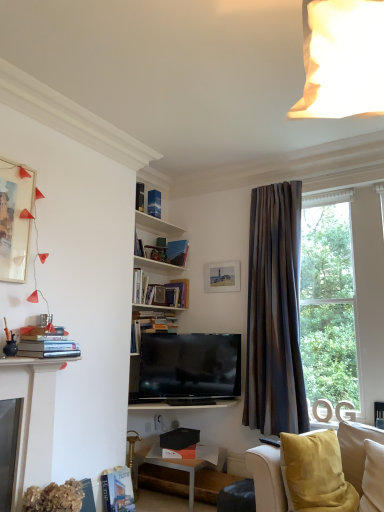
Question: Can you confirm if matte white picture frame at upper left, acting as the second picture frame starting from the back, is positioned to the left of hardcover book at center, which appears as the sixth book when viewed from the front?

Choices:
 (A) no
 (B) yes

Answer: (B)

Question: From the image's perspective, would you say matte white picture frame at upper left, acting as the second picture frame starting from the back, is shown under hardcover book at center, which appears as the sixth book when viewed from the front?

Choices:
 (A) no
 (B) yes

Answer: (A)

Question: Is matte white picture frame at upper left, which is counted as the 2th picture frame, starting from the right, turned away from hardcover book at center, placed as the first book when sorted from back to front?

Choices:
 (A) no
 (B) yes

Answer: (A)

Question: Is matte white picture frame at upper left, the first picture frame viewed from the top, facing towards hardcover book at center, which is counted as the third book, starting from the top?

Choices:
 (A) yes
 (B) no

Answer: (B)

Question: Does matte white picture frame at upper left, acting as the 1th picture frame starting from the front, contain hardcover book at center, which is the fourth book in bottom-to-top order?

Choices:
 (A) yes
 (B) no

Answer: (B)

Question: Relative to transparent glass window at upper right, is hardcover book at center, which is the 3th book in bottom-to-top order, in front or behind?

Choices:
 (A) front
 (B) behind

Answer: (B)

Question: In terms of height, does hardcover book at center, positioned as the 4th book in top-to-bottom order, look taller or shorter compared to transparent glass window at upper right?

Choices:
 (A) tall
 (B) short

Answer: (B)

Question: Does point (173, 284) appear closer or farther from the camera than point (302, 340)?

Choices:
 (A) closer
 (B) farther

Answer: (B)

Question: From the image's perspective, relative to transparent glass window at upper right, is hardcover book at center, arranged as the 2th book when viewed from the back, above or below?

Choices:
 (A) above
 (B) below

Answer: (A)

Question: Relative to hardcover books at left, placed as the second book when sorted from bottom to top, is blue paper book at upper center, the fourth book viewed from the front, in front or behind?

Choices:
 (A) front
 (B) behind

Answer: (B)

Question: Considering the relative positions of blue paper book at upper center, the 2th book viewed from the top, and hardcover books at left, arranged as the fifth book when viewed from the top, in the image provided, is blue paper book at upper center, the 2th book viewed from the top, to the left or to the right of hardcover books at left, arranged as the fifth book when viewed from the top,?

Choices:
 (A) right
 (B) left

Answer: (A)

Question: From a real-world perspective, relative to hardcover books at left, which is the sixth book from back to front, is blue paper book at upper center, the fourth book viewed from the front, vertically above or below?

Choices:
 (A) above
 (B) below

Answer: (A)

Question: Considering the positions of point (152, 203) and point (67, 348), is point (152, 203) closer or farther from the camera than point (67, 348)?

Choices:
 (A) closer
 (B) farther

Answer: (B)

Question: Considering the positions of blue paper book at upper center, acting as the 3th book starting from the back, and hardcover book at lower left, which is the fifth book from back to front, in the image, is blue paper book at upper center, acting as the 3th book starting from the back, wider or thinner than hardcover book at lower left, which is the fifth book from back to front,?

Choices:
 (A) thin
 (B) wide

Answer: (B)

Question: Is blue paper book at upper center, the fourth book viewed from the front, inside the boundaries of hardcover book at lower left, which is the fifth book from back to front, or outside?

Choices:
 (A) outside
 (B) inside

Answer: (A)